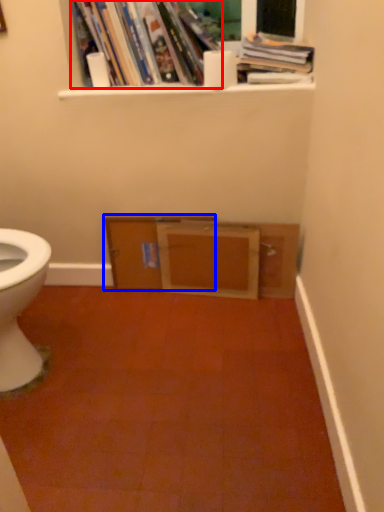
Question: Which point is further to the camera, book (highlighted by a red box) or file cabinet (highlighted by a blue box)?

Choices:
 (A) book
 (B) file cabinet

Answer: (B)